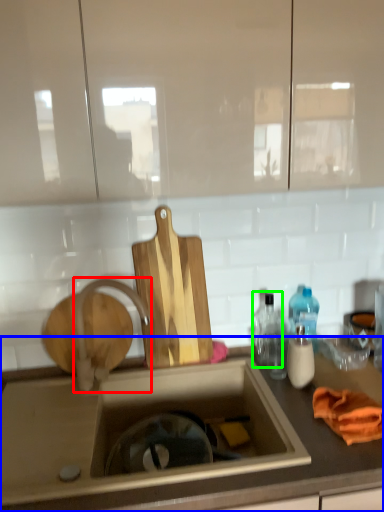
Question: Considering the real-world distances, which object is closest to tap (highlighted by a red box)? countertop (highlighted by a blue box) or bottle (highlighted by a green box).

Choices:
 (A) countertop
 (B) bottle

Answer: (A)